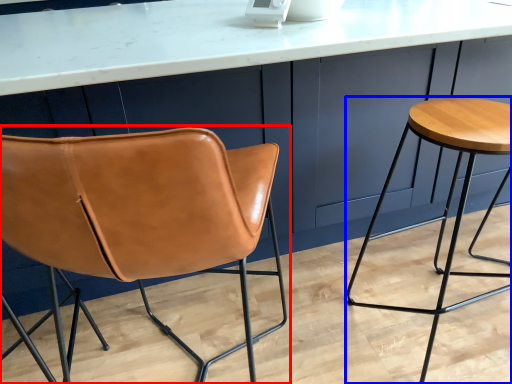
Question: Among these objects, which one is nearest to the camera, chair (highlighted by a red box) or stool (highlighted by a blue box)?

Choices:
 (A) chair
 (B) stool

Answer: (A)